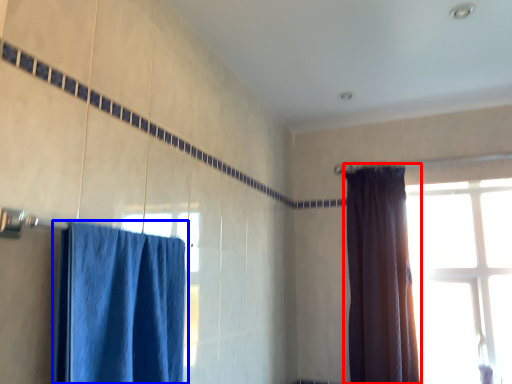
Question: Which object is further to the camera taking this photo, curtain (highlighted by a red box) or curtain (highlighted by a blue box)?

Choices:
 (A) curtain
 (B) curtain

Answer: (A)